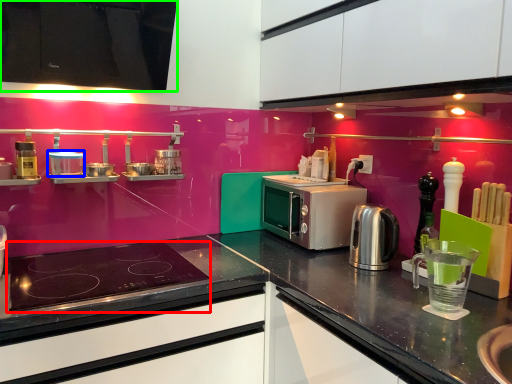
Question: Based on their relative distances, which object is nearer to gas stove (highlighted by a red box)? Choose from appliance (highlighted by a blue box) and cabinetry (highlighted by a green box).

Choices:
 (A) appliance
 (B) cabinetry

Answer: (A)